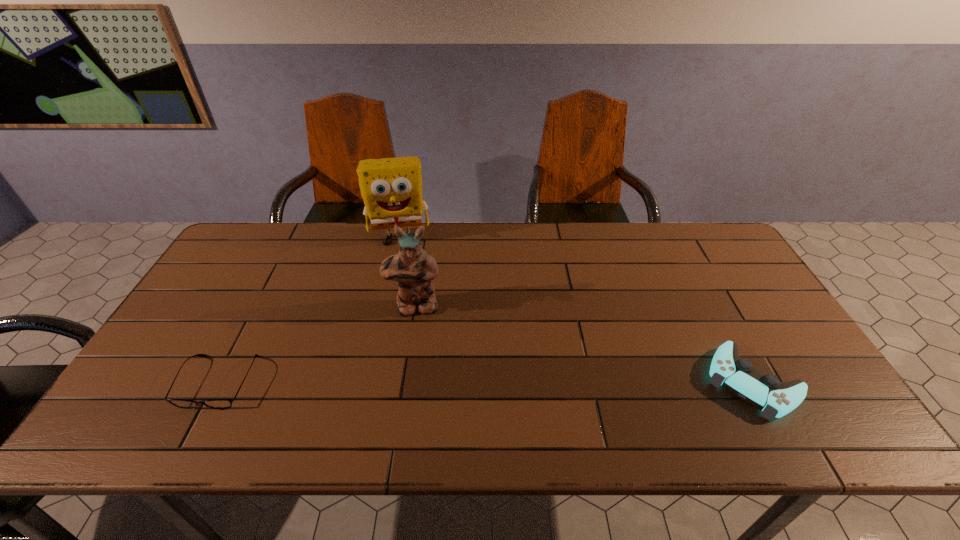
Locate an element on the screen. Image resolution: width=960 pixels, height=540 pixels. the leftmost object is located at coordinates (180, 403).

At what (x,y) coordinates should I click in order to perform the action: click on the shortest object. Please return your answer as a coordinate pair (x, y). Looking at the image, I should click on (180, 403).

What are the coordinates of `the rightmost object` in the screenshot? It's located at (765, 392).

The height and width of the screenshot is (540, 960). In order to click on control in this screenshot , I will do `click(765, 392)`.

At what (x,y) coordinates should I click in order to perform the action: click on the second farthest object. Please return your answer as a coordinate pair (x, y). Looking at the image, I should click on (413, 268).

In order to click on sponge in this screenshot , I will do `click(391, 188)`.

Where is `vacant region located on the left of the third tallest object`? vacant region located on the left of the third tallest object is located at coordinates (631, 382).

I want to click on vacant area situated on the front-facing side of the figurine, so click(x=415, y=386).

You are a GUI agent. You are given a task and a screenshot of the screen. Output one action in this format:
    pyautogui.click(x=<x>, y=<y>)
    Task: Click on the vacant space located 0.170m on the front-facing side of the figurine
    
    Given the screenshot: What is the action you would take?
    pyautogui.click(x=415, y=369)

Identify the location of free space located 0.270m on the front-facing side of the figurine. (414, 404).